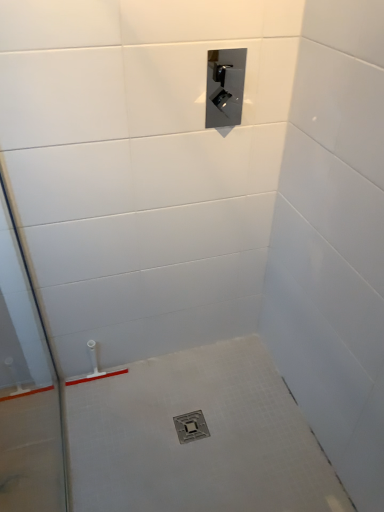
Question: Considering the relative positions of transparent glass door at left and satin nickel control panel at upper center in the image provided, is transparent glass door at left to the left of satin nickel control panel at upper center from the viewer's perspective?

Choices:
 (A) yes
 (B) no

Answer: (A)

Question: Is transparent glass door at left to the right of satin nickel control panel at upper center from the viewer's perspective?

Choices:
 (A) yes
 (B) no

Answer: (B)

Question: Does transparent glass door at left have a larger size compared to satin nickel control panel at upper center?

Choices:
 (A) yes
 (B) no

Answer: (A)

Question: Can you confirm if transparent glass door at left is wider than satin nickel control panel at upper center?

Choices:
 (A) yes
 (B) no

Answer: (A)

Question: From a real-world perspective, is transparent glass door at left physically above satin nickel control panel at upper center?

Choices:
 (A) yes
 (B) no

Answer: (B)

Question: From the image's perspective, relative to satin nickel control panel at upper center, is transparent glass door at left above or below?

Choices:
 (A) below
 (B) above

Answer: (A)

Question: Based on their positions, is transparent glass door at left located to the left or right of satin nickel control panel at upper center?

Choices:
 (A) right
 (B) left

Answer: (B)

Question: Relative to satin nickel control panel at upper center, is transparent glass door at left in front or behind?

Choices:
 (A) behind
 (B) front

Answer: (B)

Question: Does point (44, 409) appear closer or farther from the camera than point (226, 58)?

Choices:
 (A) farther
 (B) closer

Answer: (A)

Question: Visually, is metallic silver drain at center positioned to the left or to the right of transparent glass door at left?

Choices:
 (A) left
 (B) right

Answer: (B)

Question: From a real-world perspective, is metallic silver drain at center positioned above or below transparent glass door at left?

Choices:
 (A) below
 (B) above

Answer: (A)

Question: From the image's perspective, relative to transparent glass door at left, is metallic silver drain at center above or below?

Choices:
 (A) below
 (B) above

Answer: (A)

Question: Is metallic silver drain at center inside the boundaries of transparent glass door at left, or outside?

Choices:
 (A) outside
 (B) inside

Answer: (A)

Question: Considering the positions of point (223, 118) and point (0, 342), is point (223, 118) closer or farther from the camera than point (0, 342)?

Choices:
 (A) farther
 (B) closer

Answer: (A)

Question: Looking at their shapes, would you say satin nickel control panel at upper center is wider or thinner than transparent glass door at left?

Choices:
 (A) thin
 (B) wide

Answer: (A)